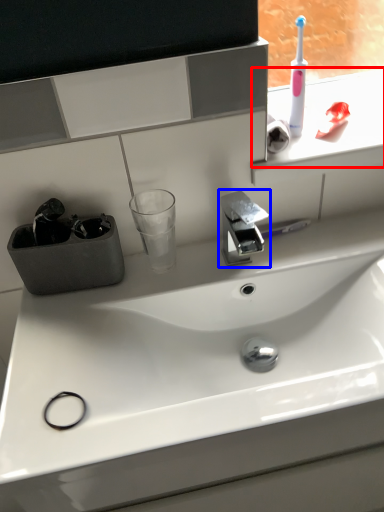
Question: Which object is closer to the camera taking this photo, window sill (highlighted by a red box) or tap (highlighted by a blue box)?

Choices:
 (A) window sill
 (B) tap

Answer: (B)